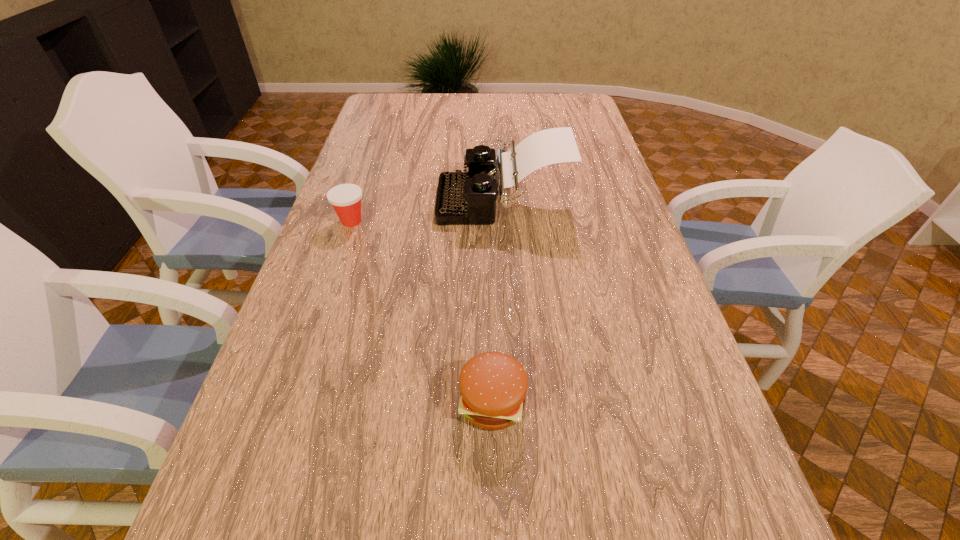
Choose which object is the second nearest neighbor to the typewriter. Please provide its 2D coordinates. Your answer should be formatted as a tuple, i.e. [(x, y)], where the tuple contains the x and y coordinates of a point satisfying the conditions above.

[(493, 385)]